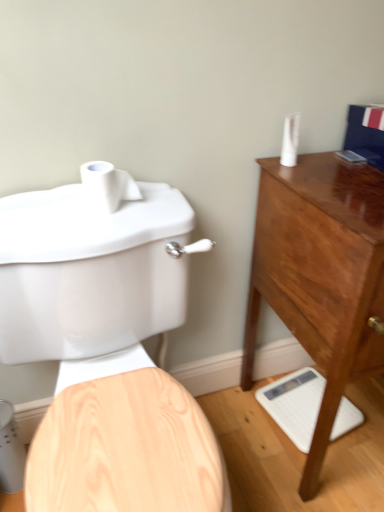
Question: In the image, is white plastic toothpaste tube at upper right positioned in front of or behind mahogany wood chest of drawers at right?

Choices:
 (A) behind
 (B) front

Answer: (A)

Question: From the image's perspective, is white plastic toothpaste tube at upper right above or below mahogany wood chest of drawers at right?

Choices:
 (A) above
 (B) below

Answer: (A)

Question: Which object is positioned closest to the white matte toilet paper at upper left?

Choices:
 (A) matte white toilet at left
 (B) white glossy scale at lower right
 (C) mahogany wood chest of drawers at right
 (D) white plastic toothpaste tube at upper right

Answer: (A)

Question: Considering the real-world distances, which object is closest to the matte white toilet at left?

Choices:
 (A) mahogany wood chest of drawers at right
 (B) white glossy scale at lower right
 (C) white plastic toothpaste tube at upper right
 (D) white matte toilet paper at upper left

Answer: (D)